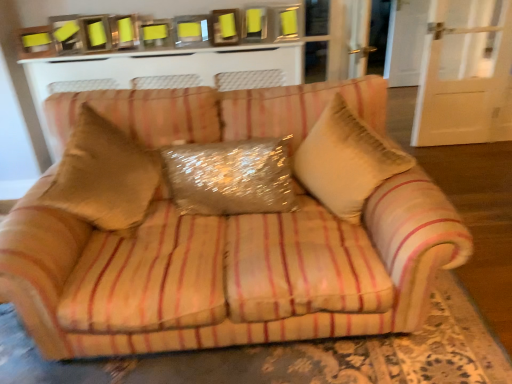
Measure the distance between point (328, 190) and camera.

The distance of point (328, 190) from camera is 1.73 meters.

Measure the distance between point (248, 140) and camera.

Point (248, 140) is 1.86 meters away from camera.

What do you see at coordinates (231, 177) in the screenshot? The image size is (512, 384). I see `sparkly metallic pillow at center` at bounding box center [231, 177].

Measure the distance between white textured cabinet at upper center and camera.

They are 8.38 feet apart.

Identify the location of beige striped fabric couch at center. (228, 272).

From the image's perspective, would you say sparkly metallic pillow at center is positioned over white textured cabinet at upper center?

No, from the image's perspective, sparkly metallic pillow at center is not over white textured cabinet at upper center.

Is sparkly metallic pillow at center thinner than white textured cabinet at upper center?

Yes.

Does sparkly metallic pillow at center come in front of white textured cabinet at upper center?

Yes, it is.

Based on the photo, is white textured cabinet at upper center inside sparkly metallic pillow at center?

That's incorrect, white textured cabinet at upper center is not inside sparkly metallic pillow at center.

From a real-world perspective, which is physically below, beige striped fabric couch at center or sparkly metallic pillow at center?

In real-world perspective, beige striped fabric couch at center is lower.

Considering the relative sizes of beige striped fabric couch at center and sparkly metallic pillow at center in the image provided, is beige striped fabric couch at center shorter than sparkly metallic pillow at center?

Yes.

Can you see beige striped fabric couch at center touching sparkly metallic pillow at center?

beige striped fabric couch at center and sparkly metallic pillow at center are clearly separated.

From the image's perspective, is beige striped fabric couch at center below sparkly metallic pillow at center?

Indeed, from the image's perspective, beige striped fabric couch at center is shown beneath sparkly metallic pillow at center.

Are sparkly metallic pillow at center and beige textured pillow at center located far from each other?

No.

Is sparkly metallic pillow at center taller than beige textured pillow at center?

Incorrect, the height of sparkly metallic pillow at center is not larger of that of beige textured pillow at center.

Is sparkly metallic pillow at center oriented towards beige textured pillow at center?

No, sparkly metallic pillow at center is not oriented towards beige textured pillow at center.

Which is farther from the camera, [97,62] or [333,108]?

The point [97,62] is behind.

Is beige textured pillow at center located within white textured cabinet at upper center?

No, beige textured pillow at center is located outside of white textured cabinet at upper center.

Is white textured cabinet at upper center oriented away from beige textured pillow at center?

white textured cabinet at upper center does not have its back to beige textured pillow at center.

Is white textured cabinet at upper center bigger or smaller than beige textured pillow at center?

white textured cabinet at upper center is bigger than beige textured pillow at center.

From a real-world perspective, which object rests below the other?

beige striped fabric couch at center, from a real-world perspective.

From the image's perspective, between beige striped fabric couch at center and white textured cabinet at upper center, which one is located above?

white textured cabinet at upper center appears higher in the image.

Considering the sizes of objects beige striped fabric couch at center and white textured cabinet at upper center in the image provided, who is shorter, beige striped fabric couch at center or white textured cabinet at upper center?

With less height is beige striped fabric couch at center.

Does beige striped fabric couch at center touch white textured cabinet at upper center?

No, beige striped fabric couch at center is not making contact with white textured cabinet at upper center.

Considering the relative sizes of beige textured pillow at center and beige striped fabric couch at center in the image provided, is beige textured pillow at center thinner than beige striped fabric couch at center?

Correct, the width of beige textured pillow at center is less than that of beige striped fabric couch at center.

Which is more to the left, beige textured pillow at center or beige striped fabric couch at center?

Positioned to the left is beige striped fabric couch at center.

Is beige textured pillow at center directly adjacent to beige striped fabric couch at center?

No.

Is beige textured pillow at center turned away from beige striped fabric couch at center?

No, beige textured pillow at center is not facing away from beige striped fabric couch at center.

Find the location of `throw pillow that appears on the right of sparkly metallic pillow at center`. throw pillow that appears on the right of sparkly metallic pillow at center is located at coordinates (346, 160).

Based on the photo, is sparkly metallic pillow at center surrounded by beige textured pillow at center?

No, beige textured pillow at center does not contain sparkly metallic pillow at center.

Consider the image. From the image's perspective, is beige textured pillow at center under sparkly metallic pillow at center?

Actually, beige textured pillow at center appears above sparkly metallic pillow at center in the image.

Where is `pillow on the right of the white textured cabinet at upper center`? pillow on the right of the white textured cabinet at upper center is located at coordinates (231, 177).

Locate an element on the screen. studio couch below the sparkly metallic pillow at center (from the image's perspective) is located at coordinates (228, 272).

Based on their spatial positions, is beige striped fabric couch at center or white textured cabinet at upper center further from beige textured pillow at center?

Based on the image, white textured cabinet at upper center appears to be further to beige textured pillow at center.

Looking at the image, which one is located further to sparkly metallic pillow at center, beige striped fabric couch at center or beige textured pillow at center?

beige striped fabric couch at center lies further to sparkly metallic pillow at center than the other object.

Looking at the image, which one is located closer to sparkly metallic pillow at center, beige textured pillow at center or white textured cabinet at upper center?

beige textured pillow at center.

Based on their spatial positions, is beige textured pillow at center or beige striped fabric couch at center further from white textured cabinet at upper center?

beige striped fabric couch at center lies further to white textured cabinet at upper center than the other object.

Based on their spatial positions, is white textured cabinet at upper center or beige textured pillow at center further from sparkly metallic pillow at center?

Based on the image, white textured cabinet at upper center appears to be further to sparkly metallic pillow at center.

Consider the image. Looking at the image, which one is located further to beige striped fabric couch at center, beige textured pillow at center or white textured cabinet at upper center?

The object further to beige striped fabric couch at center is white textured cabinet at upper center.

Based on their spatial positions, is sparkly metallic pillow at center or white textured cabinet at upper center closer to beige textured pillow at center?

Among the two, sparkly metallic pillow at center is located nearer to beige textured pillow at center.

When comparing their distances from beige textured pillow at center, does sparkly metallic pillow at center or beige striped fabric couch at center seem closer?

sparkly metallic pillow at center is positioned closer to the anchor beige textured pillow at center.

You are a GUI agent. You are given a task and a screenshot of the screen. Output one action in this format:
    pyautogui.click(x=<x>, y=<y>)
    Task: Click on the pillow between beige striped fabric couch at center and white textured cabinet at upper center in the front-back direction
    The height and width of the screenshot is (384, 512).
    Given the screenshot: What is the action you would take?
    pyautogui.click(x=231, y=177)

I want to click on studio couch between beige textured pillow at center and white textured cabinet at upper center from front to back, so click(228, 272).

At what (x,y) coordinates should I click in order to perform the action: click on pillow between beige textured pillow at center and white textured cabinet at upper center along the z-axis. Please return your answer as a coordinate pair (x, y). Looking at the image, I should click on (231, 177).

At what (x,y) coordinates should I click in order to perform the action: click on studio couch between sparkly metallic pillow at center and beige textured pillow at center. Please return your answer as a coordinate pair (x, y). Image resolution: width=512 pixels, height=384 pixels. Looking at the image, I should click on (228, 272).